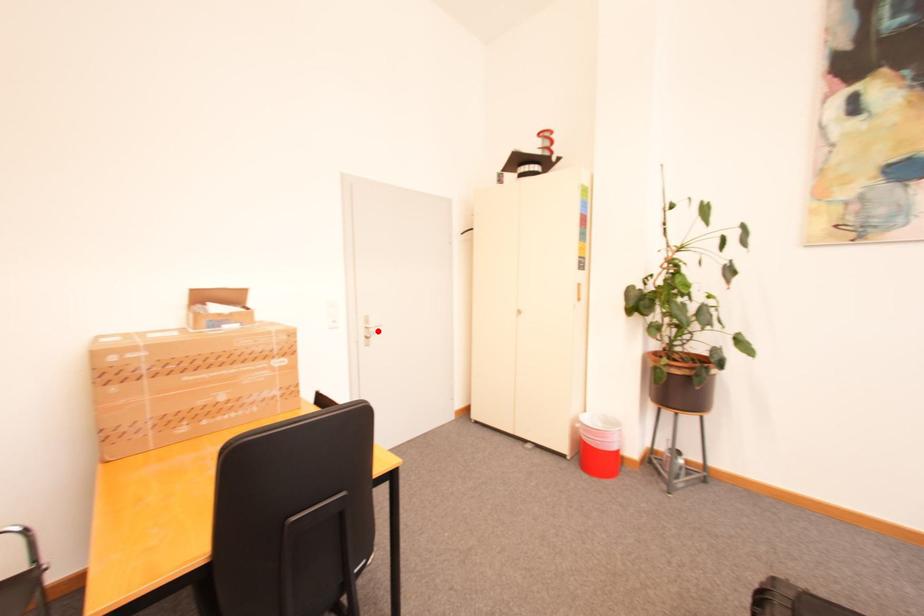
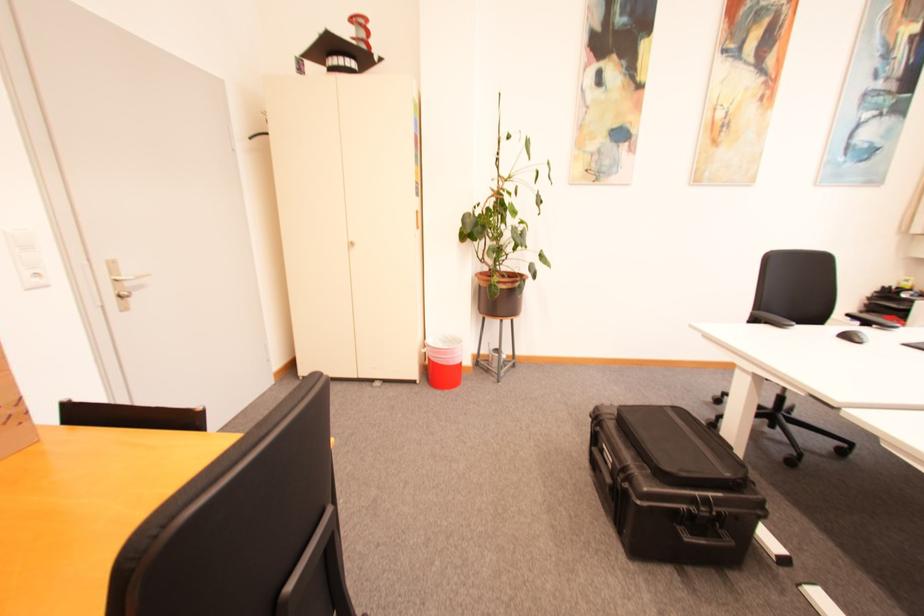
Find the pixel in the second image that matches the highlighted location in the first image.

(134, 285)